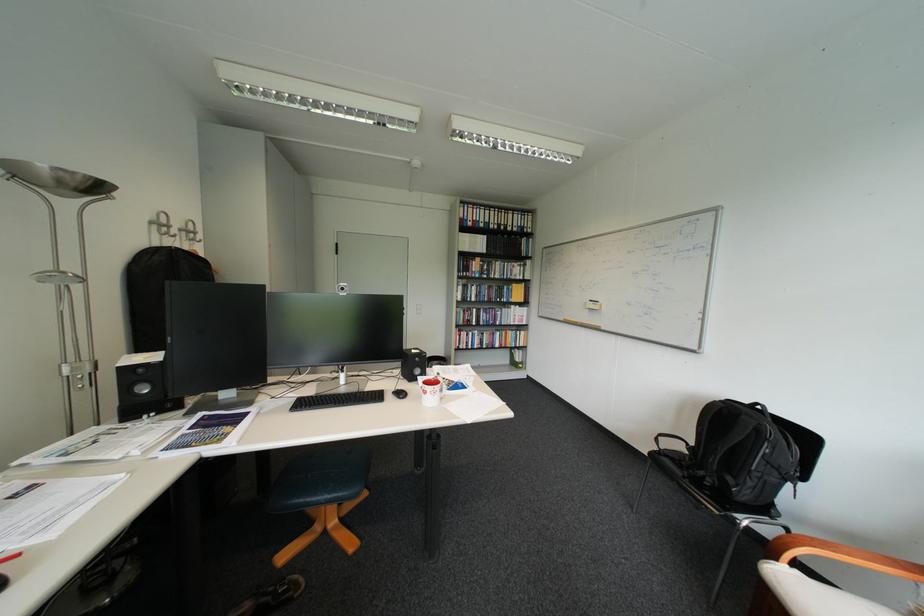
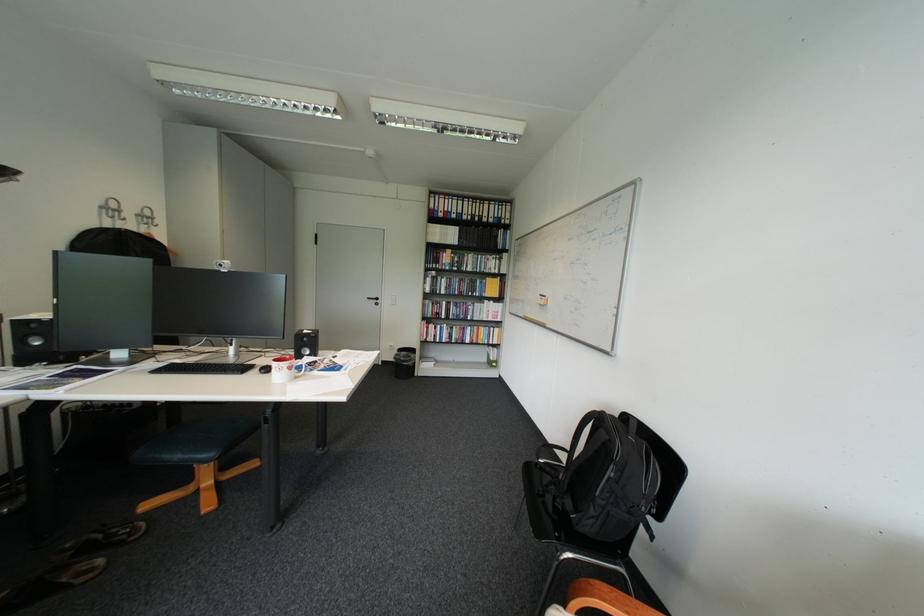
Find the pixel in the second image that matches point (762, 471) in the first image.

(608, 496)